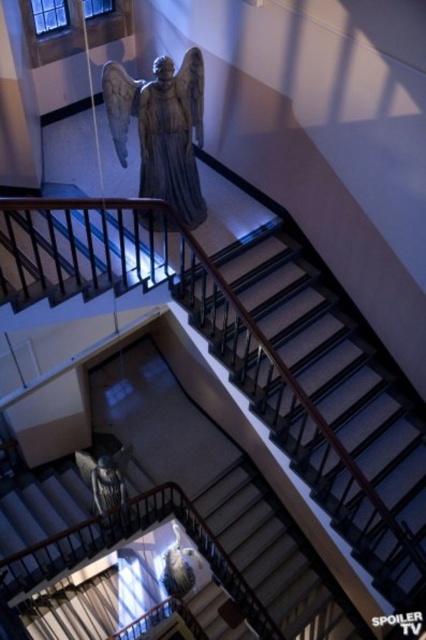
Can you confirm if smooth gray stairs at center is shorter than matte gray statue at center?

In fact, smooth gray stairs at center may be taller than matte gray statue at center.

This screenshot has height=640, width=426. What are the coordinates of `smooth gray stairs at center` in the screenshot? It's located at (310, 419).

This screenshot has height=640, width=426. What are the coordinates of `smooth gray stairs at center` in the screenshot? It's located at (310, 419).

Is point (72, 198) farther from camera compared to point (143, 189)?

No, (72, 198) is in front of (143, 189).

Find the location of `black metal balustrade at upper center`. black metal balustrade at upper center is located at coordinates (77, 250).

Does matte gray statue at center come in front of white marble pillar at upper left?

No, it is not.

Can you confirm if matte gray statue at center is positioned to the left of white marble pillar at upper left?

In fact, matte gray statue at center is to the right of white marble pillar at upper left.

Is point (103, 88) less distant than point (2, 54)?

Yes, point (103, 88) is in front of point (2, 54).

Locate an element on the screen. This screenshot has height=640, width=426. matte gray statue at center is located at coordinates (161, 129).